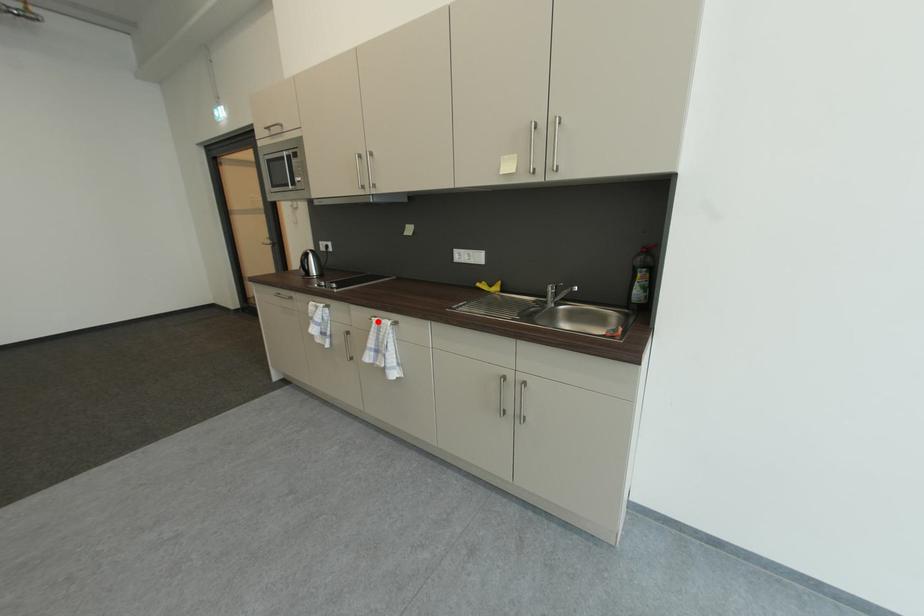
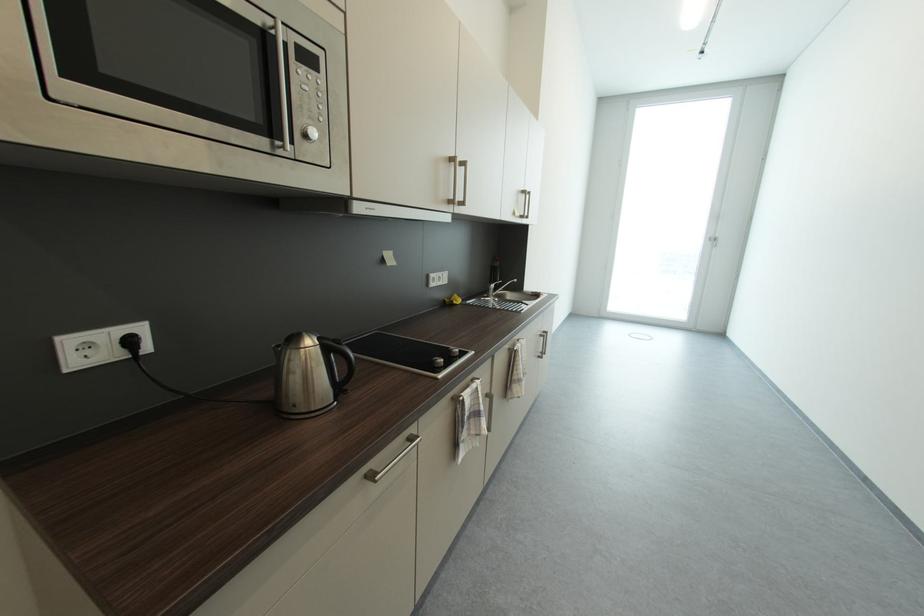
In the second image, find the point that corresponds to the highlighted location in the first image.

(523, 351)